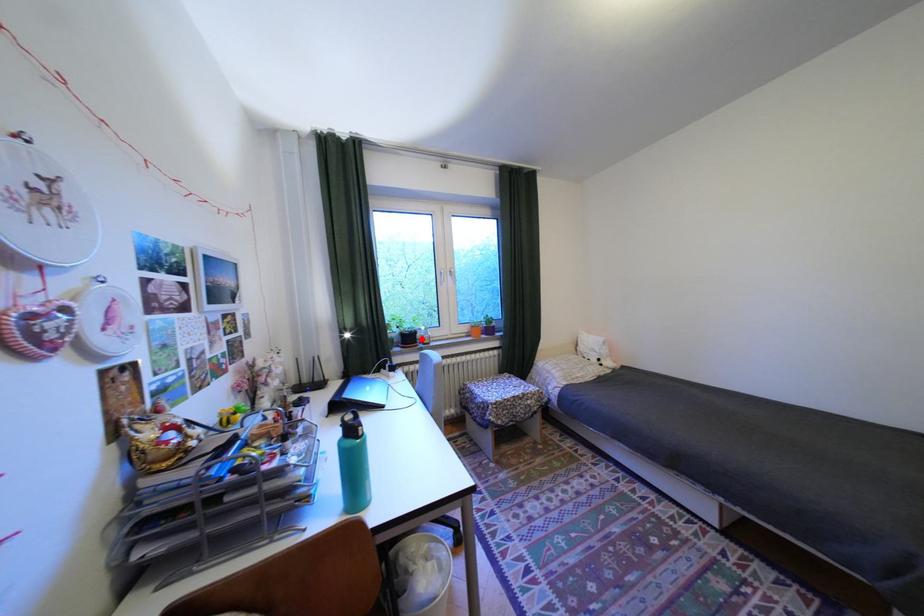
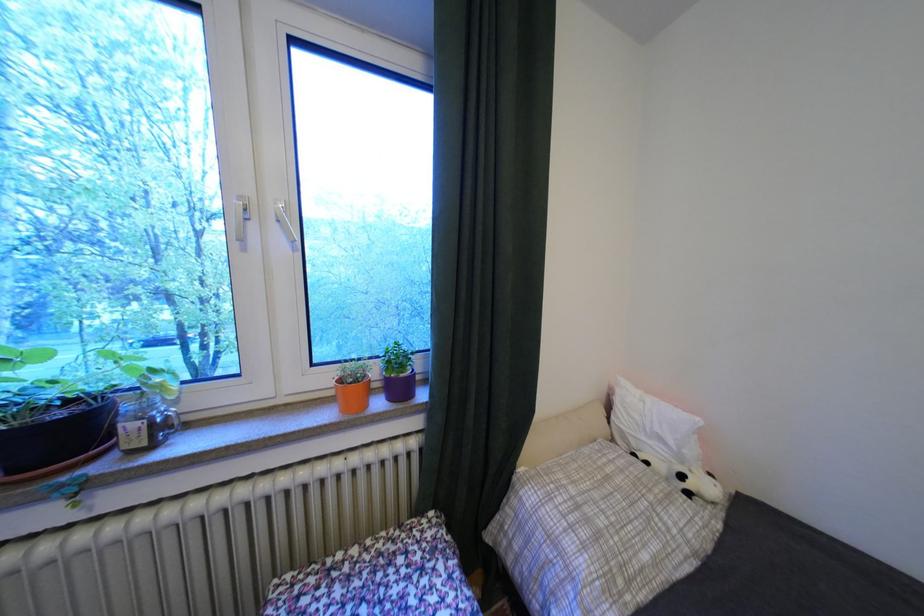
Find the pixel in the second image that matches the highlighted location in the first image.

(75, 436)